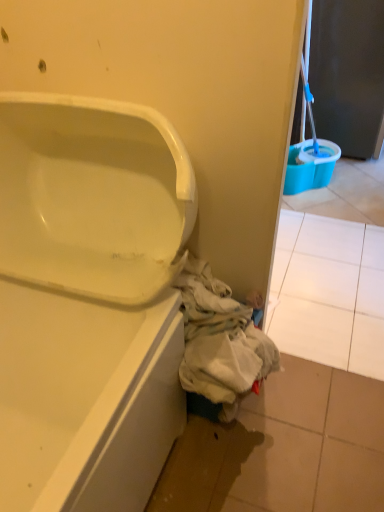
Question: Does white glossy bathtub at lower left have a greater width compared to white tile at lower right?

Choices:
 (A) no
 (B) yes

Answer: (A)

Question: Is white glossy bathtub at lower left to the right of white tile at lower right from the viewer's perspective?

Choices:
 (A) no
 (B) yes

Answer: (A)

Question: Is white glossy bathtub at lower left shorter than white tile at lower right?

Choices:
 (A) no
 (B) yes

Answer: (A)

Question: Is white glossy bathtub at lower left oriented towards white tile at lower right?

Choices:
 (A) yes
 (B) no

Answer: (B)

Question: Is white glossy bathtub at lower left touching white tile at lower right?

Choices:
 (A) no
 (B) yes

Answer: (A)

Question: Is white glossy bathtub at lower left looking in the opposite direction of white tile at lower right?

Choices:
 (A) no
 (B) yes

Answer: (A)

Question: From the image's perspective, does white tile at lower right appear lower than white glossy bathtub at lower left?

Choices:
 (A) yes
 (B) no

Answer: (B)

Question: Does white tile at lower right have a lesser height compared to white glossy bathtub at lower left?

Choices:
 (A) no
 (B) yes

Answer: (B)

Question: Is white tile at lower right looking in the opposite direction of white glossy bathtub at lower left?

Choices:
 (A) no
 (B) yes

Answer: (A)

Question: Is white tile at lower right at the right side of white glossy bathtub at lower left?

Choices:
 (A) yes
 (B) no

Answer: (A)

Question: Is white tile at lower right oriented towards white glossy bathtub at lower left?

Choices:
 (A) yes
 (B) no

Answer: (B)

Question: Does white tile at lower right have a lesser width compared to white glossy bathtub at lower left?

Choices:
 (A) yes
 (B) no

Answer: (B)

Question: Can you confirm if matte black screen door at upper right is thinner than white tile at lower right?

Choices:
 (A) no
 (B) yes

Answer: (B)